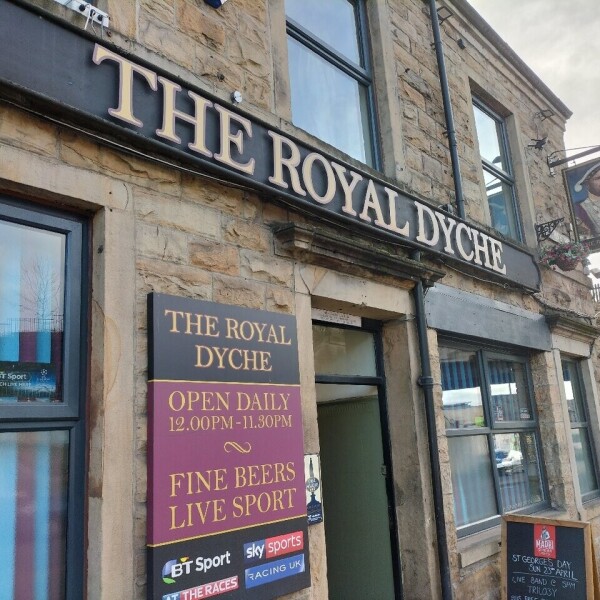
At what (x,y) coordinates should I click in order to perform the action: click on wall. Please return your answer as a coordinate pair (x, y). Looking at the image, I should click on (189, 231).